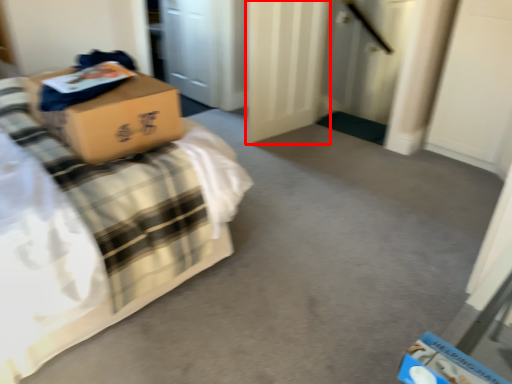
Question: From the image, what is the correct spatial relationship of door (annotated by the red box) in relation to bed?

Choices:
 (A) right
 (B) left

Answer: (A)